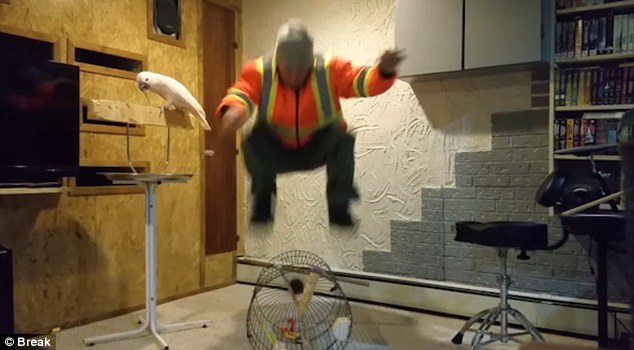
The width and height of the screenshot is (634, 350). In order to click on shelf with vhs tapes in this screenshot , I will do (586, 75).